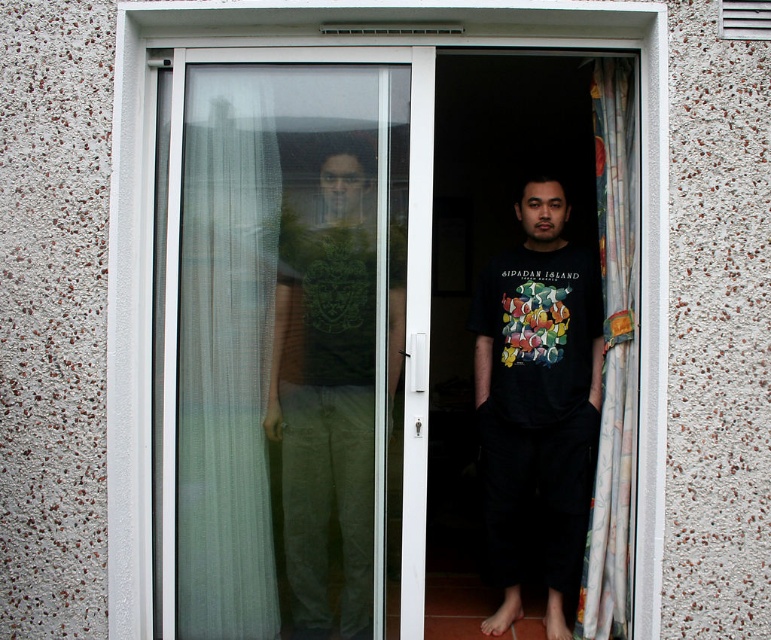
From the picture: You are trying to enter a room through the doorway. The transparent plastic screen door at center and the translucent fabric curtain at left are in your way. Which object will you touch first when approaching the doorway from outside?

The transparent plastic screen door at center is closer to you at 8.02 centimeters from the translucent fabric curtain at left, so you will touch the transparent plastic screen door at center first when approaching from outside.